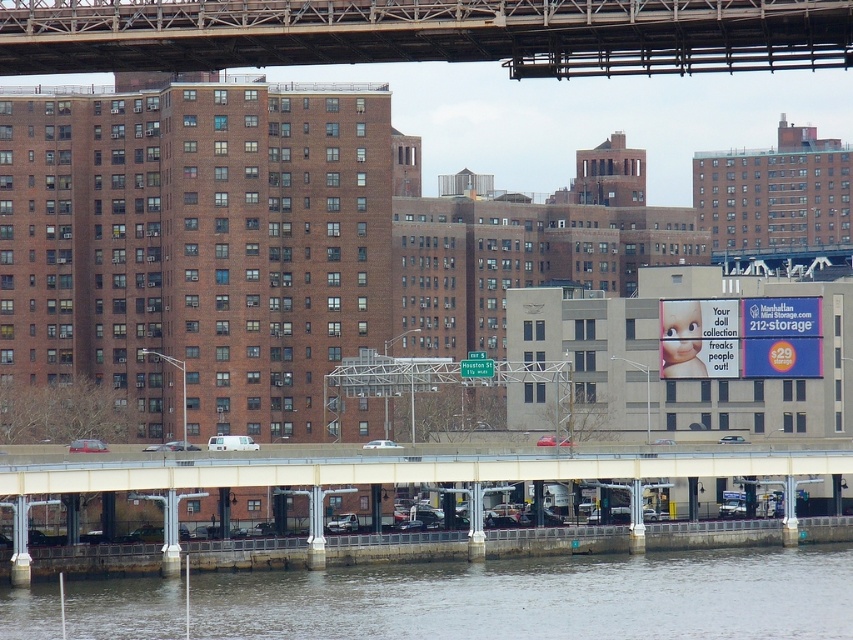
Question: Among these points, which one is farthest from the camera?

Choices:
 (A) tap(585, 51)
 (B) tap(590, 573)
 (C) tap(471, 468)

Answer: (C)

Question: Can you confirm if gray concrete river at lower center is positioned to the right of metallic gray bridge at upper center?

Choices:
 (A) no
 (B) yes

Answer: (B)

Question: Does gray concrete river at lower center appear over concrete bridge at lower center?

Choices:
 (A) no
 (B) yes

Answer: (A)

Question: Considering the real-world distances, which object is farthest from the metallic gray bridge at upper center?

Choices:
 (A) gray concrete river at lower center
 (B) concrete bridge at lower center

Answer: (B)

Question: Does gray concrete river at lower center appear under concrete bridge at lower center?

Choices:
 (A) yes
 (B) no

Answer: (A)

Question: Which object is closer to the camera taking this photo?

Choices:
 (A) metallic gray bridge at upper center
 (B) gray concrete river at lower center

Answer: (A)